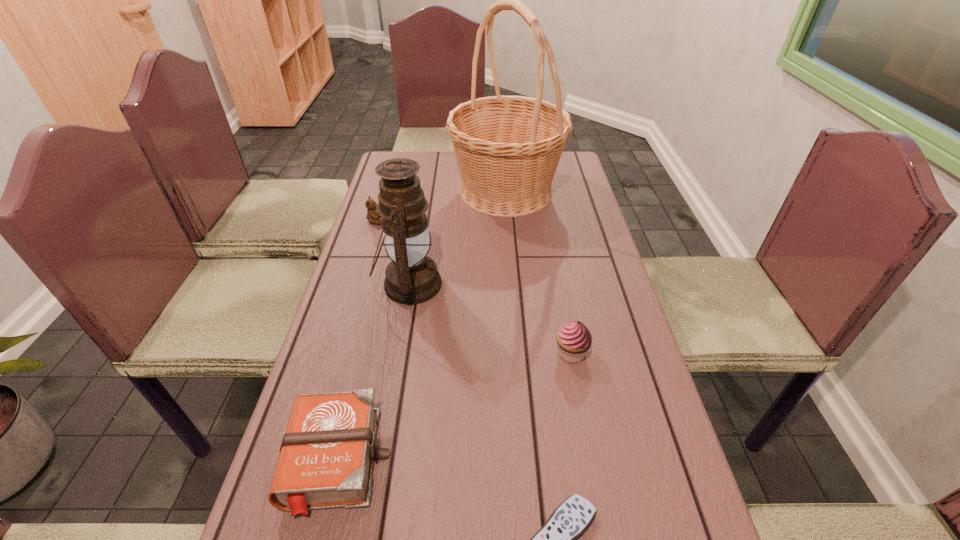
This screenshot has height=540, width=960. I want to click on basket, so click(508, 148).

Locate an element on the screen. The image size is (960, 540). the second tallest object is located at coordinates (411, 278).

Locate an element on the screen. The width and height of the screenshot is (960, 540). the fourth nearest object is located at coordinates (411, 278).

This screenshot has height=540, width=960. In order to click on cupcake in this screenshot , I will do pos(574,339).

Image resolution: width=960 pixels, height=540 pixels. What are the coordinates of `the third tallest object` in the screenshot? It's located at (574, 339).

Where is `teddy bear`? This screenshot has width=960, height=540. teddy bear is located at coordinates (372, 215).

You are a GUI agent. You are given a task and a screenshot of the screen. Output one action in this format:
    pyautogui.click(x=<x>, y=<y>)
    Task: Click on the Bible
    
    Given the screenshot: What is the action you would take?
    pyautogui.click(x=326, y=457)

Locate an element on the screen. This screenshot has width=960, height=540. vacant area located 0.150m on the front of the tallest object is located at coordinates (512, 253).

Identify the location of free space located 0.220m on the front of the fifth shortest object. This screenshot has height=540, width=960. (391, 393).

Locate an element on the screen. This screenshot has height=540, width=960. vacant space located on the back of the cupcake is located at coordinates (560, 295).